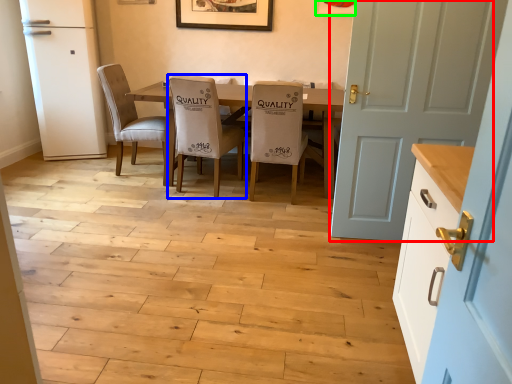
Question: Based on their relative distances, which object is nearer to door (highlighted by a red box)? Choose from chair (highlighted by a blue box) and picture frame (highlighted by a green box).

Choices:
 (A) chair
 (B) picture frame

Answer: (A)